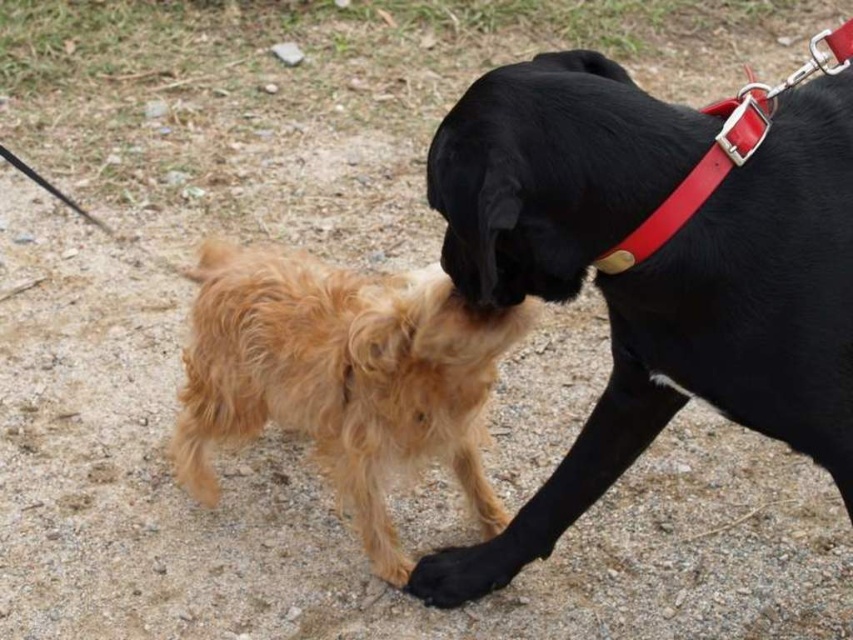
Question: Is black smooth dog at upper right above golden fur dog at center?

Choices:
 (A) yes
 (B) no

Answer: (A)

Question: Which of the following is the farthest from the observer?

Choices:
 (A) 428,452
 (B) 712,228

Answer: (A)

Question: In this image, where is black smooth dog at upper right located relative to golden fur dog at center?

Choices:
 (A) below
 (B) above

Answer: (B)

Question: Can you confirm if black smooth dog at upper right is bigger than golden fur dog at center?

Choices:
 (A) no
 (B) yes

Answer: (B)

Question: Which point is closer to the camera taking this photo?

Choices:
 (A) (428, 321)
 (B) (631, 196)

Answer: (B)